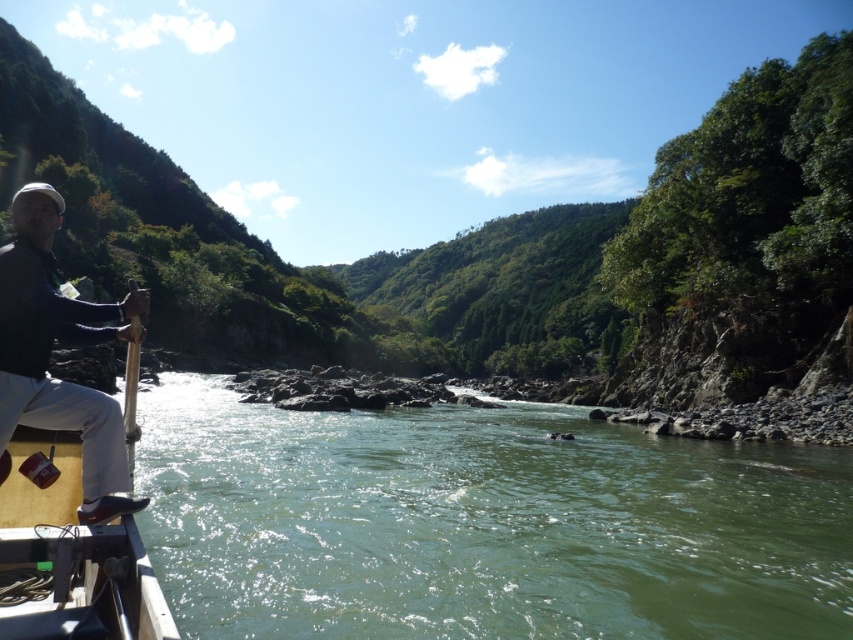
You are standing on the riverbank and see the green smooth water at center and the matte black jacket at left. Which object takes up more space in the image?

The green smooth water at center takes up more space in the image because it is larger in size than the matte black jacket at left.